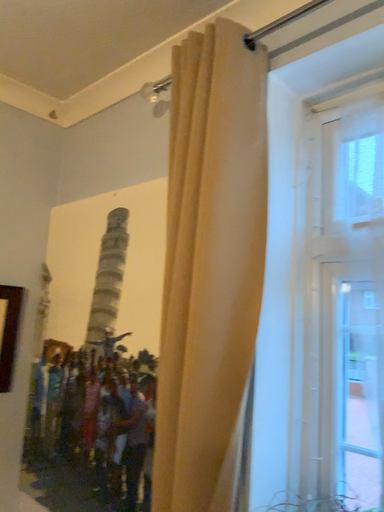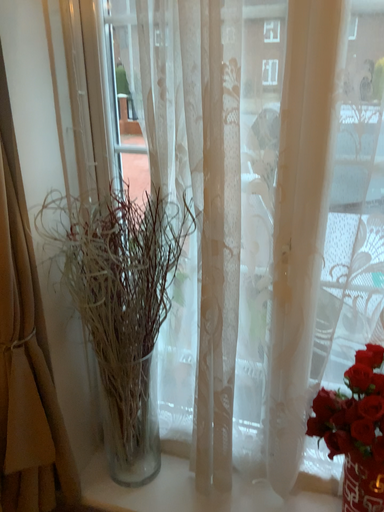
Question: How did the camera likely rotate when shooting the video?

Choices:
 (A) rotated left
 (B) rotated right

Answer: (B)